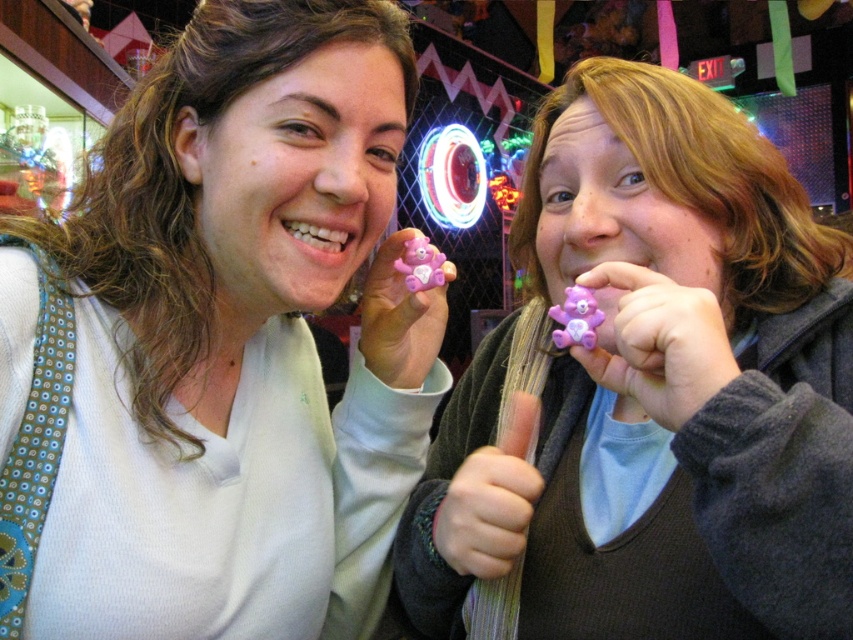
You are standing at a distance and want to reach the point marked as point [102,417]. If you take a step forward of 25 inches, will you be closer to the point than 5 inches?

The distance between you and point [102,417] is 30.03 inches. After stepping forward 25 inches, you will be 5.03 inches away, which is closer than 5 inches. So yes, you will be within 5 inches of the point.

You are organizing a charity event and need to place two teddy bears on a shelf. The shelf has a width of 15 cm. You have the pink matte bear at center and the pink plastic bear at center. Which bear can fit on the shelf if the shelf can only accommodate the narrower one?

The pink matte bear at center is narrower than the pink plastic bear at center, so it can fit on the 15 cm wide shelf.

You are at a party and see two pink bears in the center of the image. Which one is closer to you, the pink matte bear at center or the pink plastic bear at center?

The pink matte bear at center is closer to you because the pink plastic bear at center is behind it.